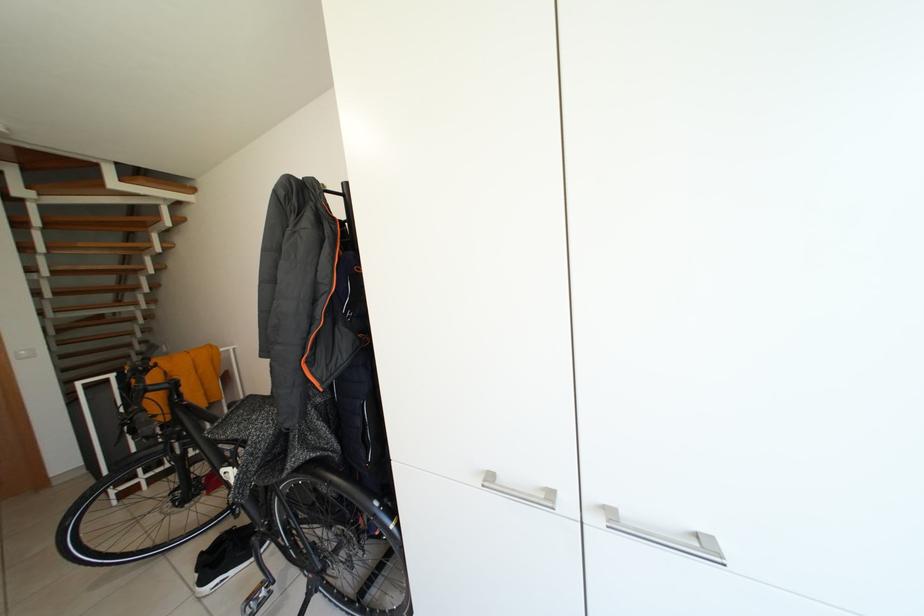
Where would you sit the bicycle saddle? Please return your answer as a coordinate pair (x, y).

(367, 533)